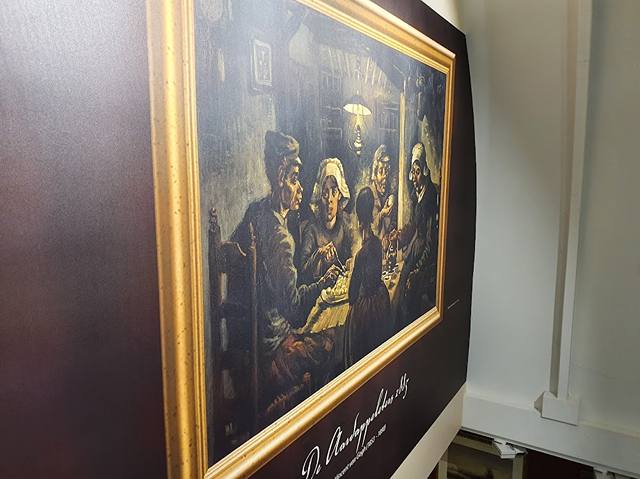
You are a GUI agent. You are given a task and a screenshot of the screen. Output one action in this format:
    pyautogui.click(x=<x>, y=<y>)
    Task: Click on the long vertical beam
    Image resolution: width=640 pixels, height=479 pixels.
    Given the screenshot: What is the action you would take?
    pyautogui.click(x=573, y=217)